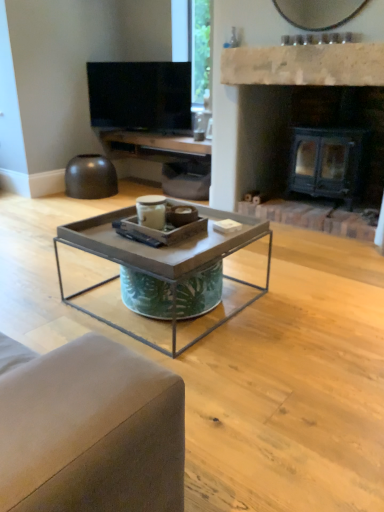
Where is `free space in front of metal/texturedcoffee table at center`? The height and width of the screenshot is (512, 384). free space in front of metal/texturedcoffee table at center is located at coordinates (249, 394).